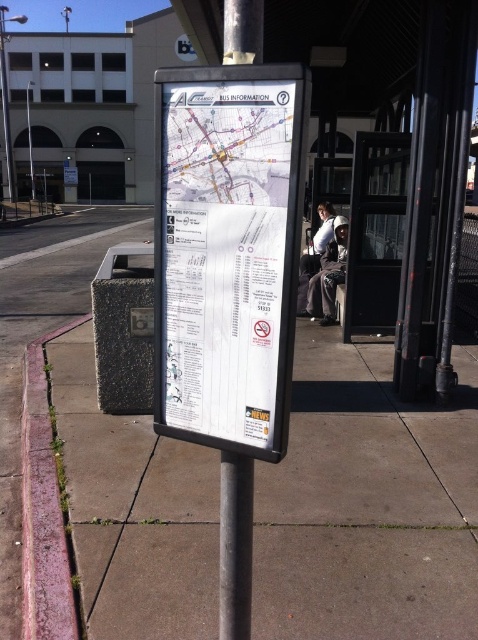
Question: Observing the image, what is the correct spatial positioning of concrete sidewalk at center in reference to white paper map at center?

Choices:
 (A) above
 (B) below

Answer: (B)

Question: Which object is positioned closest to the white paper map at center?

Choices:
 (A) pink concrete curb at lower left
 (B) concrete sidewalk at center
 (C) metallic gray pole at center

Answer: (C)

Question: Where is concrete sidewalk at center located in relation to pink concrete curb at lower left in the image?

Choices:
 (A) left
 (B) right

Answer: (B)

Question: Can you confirm if white paper map at center is positioned to the left of metallic gray pole at center?

Choices:
 (A) no
 (B) yes

Answer: (B)

Question: Which is nearer to the metallic gray pole at center?

Choices:
 (A) white paper map at center
 (B) concrete sidewalk at center
 (C) pink concrete curb at lower left

Answer: (A)

Question: Which object appears closest to the camera in this image?

Choices:
 (A) metallic gray pole at center
 (B) concrete sidewalk at center
 (C) pink concrete curb at lower left
 (D) white paper map at center

Answer: (D)